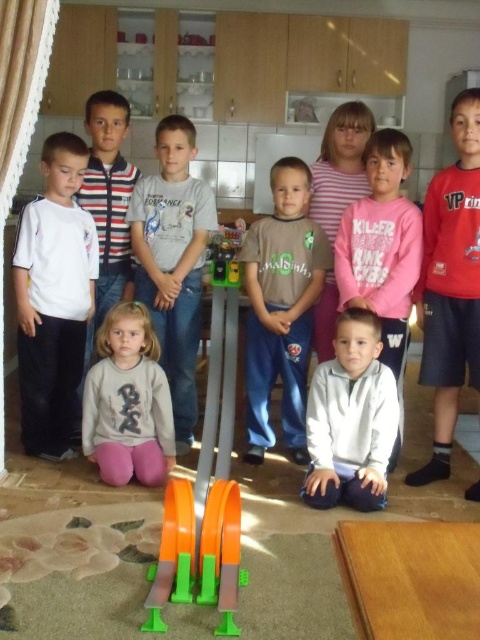
Is orange plastic toy at center bigger than striped cotton shirt at upper left?

Yes, orange plastic toy at center is bigger than striped cotton shirt at upper left.

Is point (178, 561) more distant than point (106, 252)?

That is False.

Identify the location of orange plastic toy at center. (205, 492).

Is gray cotton shirt at center taller than striped cotton shirt at upper left?

Indeed, gray cotton shirt at center has a greater height compared to striped cotton shirt at upper left.

Does gray cotton shirt at center come behind striped cotton shirt at upper left?

No, gray cotton shirt at center is closer to the viewer.

The width and height of the screenshot is (480, 640). I want to click on gray cotton shirt at center, so click(x=172, y=260).

Is gray fleece sweatshirt at lower center smaller than striped cotton shirt at upper left?

Correct, gray fleece sweatshirt at lower center occupies less space than striped cotton shirt at upper left.

Is point (373, 440) closer to viewer compared to point (91, 134)?

That is True.

Image resolution: width=480 pixels, height=640 pixels. In order to click on gray fleece sweatshirt at lower center in this screenshot , I will do click(x=350, y=419).